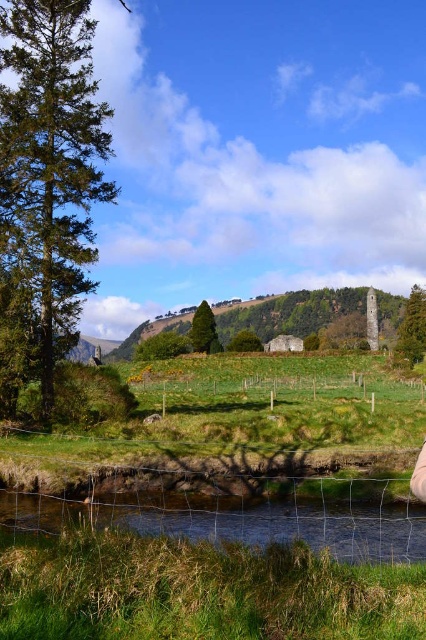
Question: Considering the relative positions of clear water at lower center and green grassy fence at center in the image provided, where is clear water at lower center located with respect to green grassy fence at center?

Choices:
 (A) right
 (B) left

Answer: (B)

Question: Does clear water at lower center have a lesser width compared to green grassy fence at center?

Choices:
 (A) no
 (B) yes

Answer: (B)

Question: Which point is farther from the camera taking this photo?

Choices:
 (A) (218, 397)
 (B) (336, 508)

Answer: (A)

Question: Which of the following is the farthest from the observer?

Choices:
 (A) green grassy fence at center
 (B) clear water at lower center

Answer: (A)

Question: Which of the following is the closest to the observer?

Choices:
 (A) clear water at lower center
 (B) green grassy fence at center

Answer: (A)

Question: Can you confirm if clear water at lower center is positioned below green grassy fence at center?

Choices:
 (A) no
 (B) yes

Answer: (A)